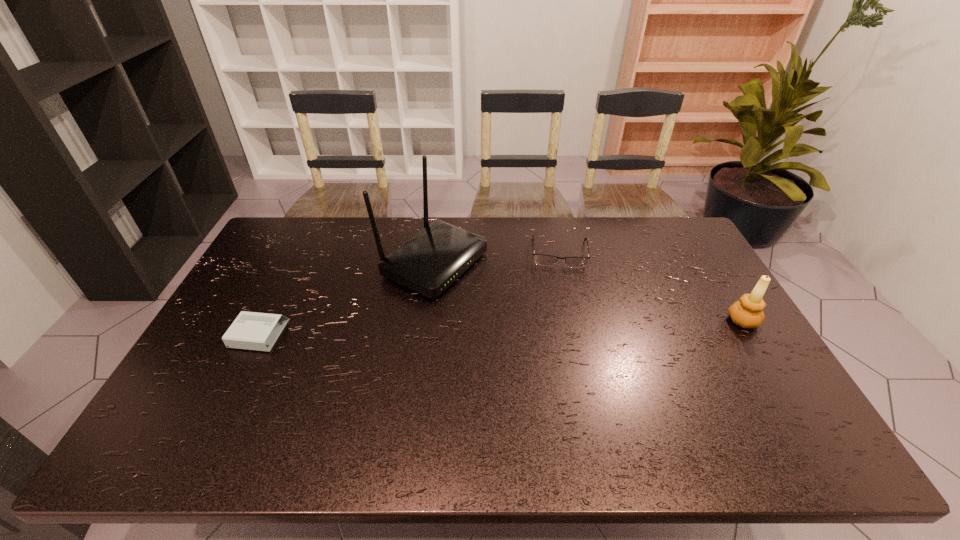
The image size is (960, 540). In order to click on empty location between the spectacles and the second tallest object in this screenshot , I will do `click(651, 286)`.

I want to click on vacant space that is in between the router and the rightmost object, so point(588,292).

The height and width of the screenshot is (540, 960). I want to click on free area in between the candle_holder and the alarm clock, so click(x=501, y=327).

You are a GUI agent. You are given a task and a screenshot of the screen. Output one action in this format:
    pyautogui.click(x=<x>, y=<y>)
    Task: Click on the blank region between the candle_holder and the spectacles
    The width and height of the screenshot is (960, 540).
    Given the screenshot: What is the action you would take?
    pyautogui.click(x=651, y=286)

Locate an element on the screen. free space between the third object from left to right and the alarm clock is located at coordinates (410, 293).

You are a GUI agent. You are given a task and a screenshot of the screen. Output one action in this format:
    pyautogui.click(x=<x>, y=<y>)
    Task: Click on the second closest object to the spectacles
    Image resolution: width=960 pixels, height=540 pixels.
    Given the screenshot: What is the action you would take?
    pyautogui.click(x=747, y=312)

Where is `object that is the closest to the second object from right to left`? object that is the closest to the second object from right to left is located at coordinates (428, 263).

Where is `vacant position in the image that satisfies the following two spatial constraints: 1. on the back side of the leftmost object; 2. on the left side of the candle_holder`? The height and width of the screenshot is (540, 960). vacant position in the image that satisfies the following two spatial constraints: 1. on the back side of the leftmost object; 2. on the left side of the candle_holder is located at coordinates (266, 321).

You are a GUI agent. You are given a task and a screenshot of the screen. Output one action in this format:
    pyautogui.click(x=<x>, y=<y>)
    Task: Click on the free space that satisfies the following two spatial constraints: 1. on the front side of the rightmost object; 2. on the right side of the tallest object
    
    Given the screenshot: What is the action you would take?
    pyautogui.click(x=426, y=321)